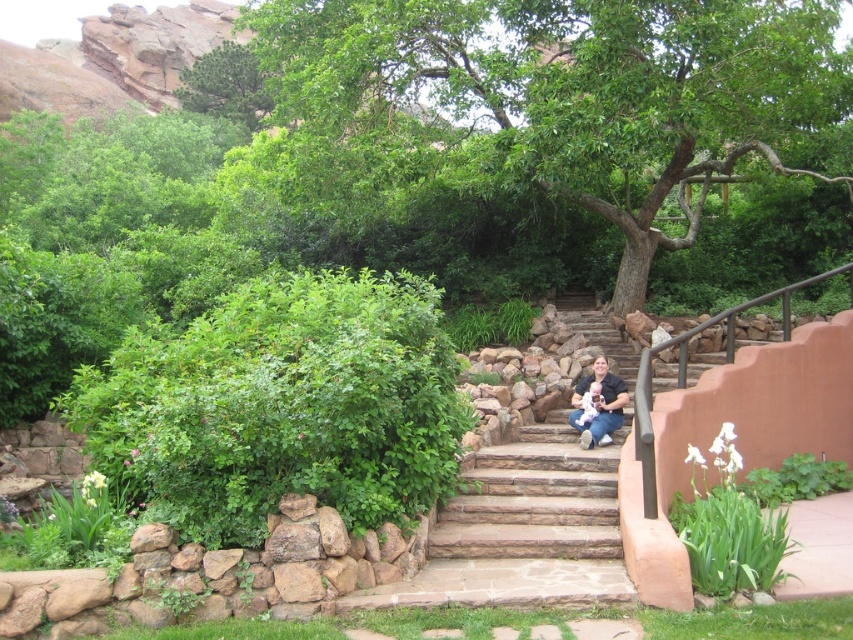
Question: Does green leafy tree at upper center appear on the right side of matte black shirt at center?

Choices:
 (A) no
 (B) yes

Answer: (A)

Question: Which point is farther to the camera?

Choices:
 (A) green leafy tree at upper center
 (B) matte black shirt at center
 (C) green leafy tree at center

Answer: (A)

Question: Can you confirm if green leafy tree at center is positioned below matte black shirt at center?

Choices:
 (A) yes
 (B) no

Answer: (B)

Question: Which point appears closest to the camera in this image?

Choices:
 (A) (207, 92)
 (B) (602, 374)

Answer: (B)

Question: Which point appears closest to the camera in this image?

Choices:
 (A) (578, 381)
 (B) (654, 67)
 (C) (260, 77)

Answer: (B)

Question: Can you confirm if green leafy tree at center is bigger than matte black shirt at center?

Choices:
 (A) yes
 (B) no

Answer: (A)